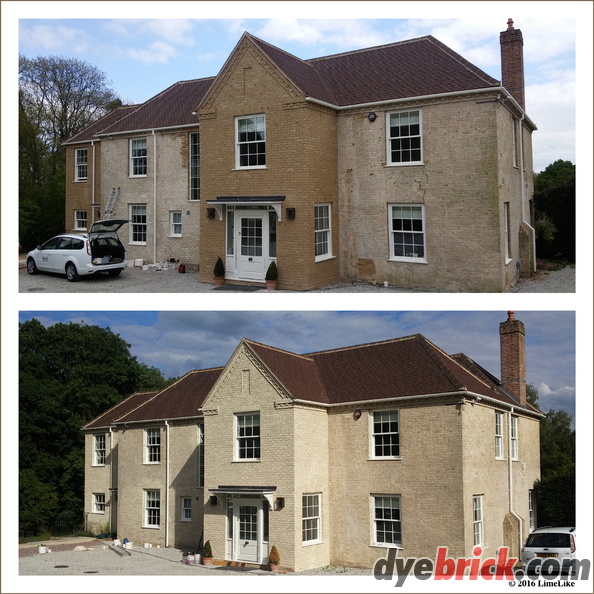
The height and width of the screenshot is (594, 594). I want to click on house door, so click(x=249, y=544), click(x=252, y=257).